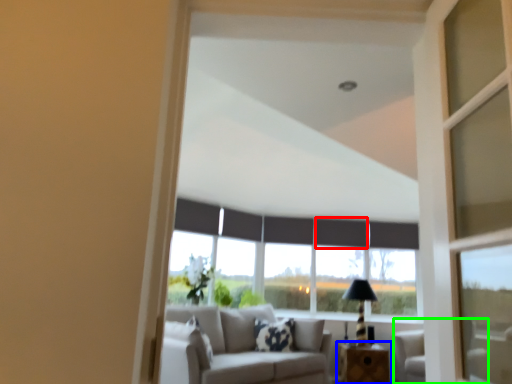
Question: Based on their relative distances, which object is nearer to curtain (highlighted by a red box)? Choose from table (highlighted by a blue box) and armchair (highlighted by a green box).

Choices:
 (A) table
 (B) armchair

Answer: (B)